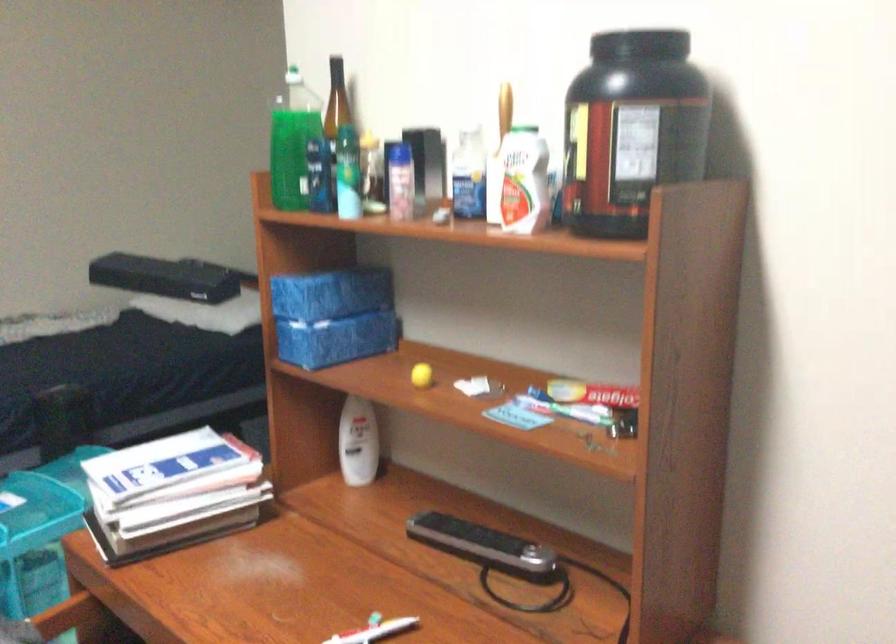
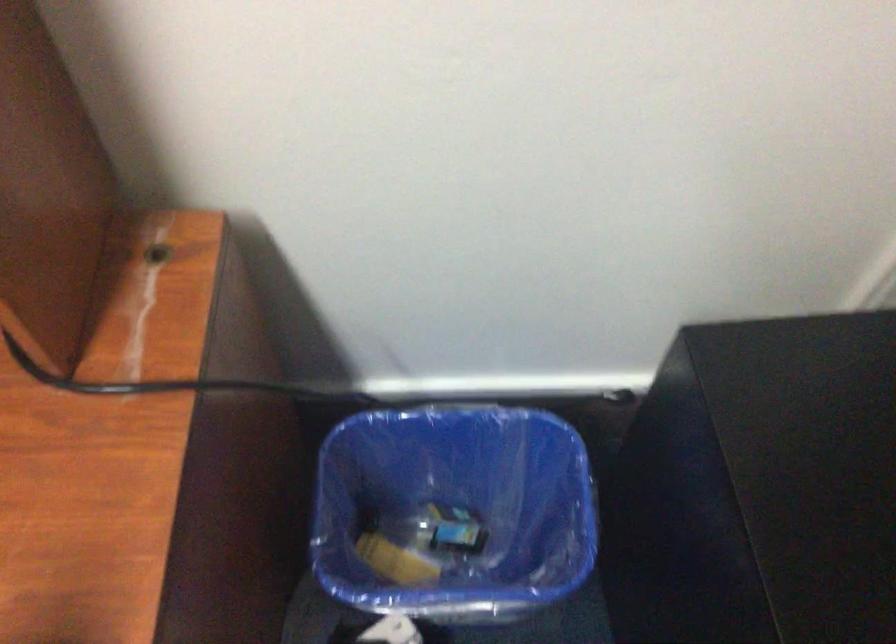
First-person continuous shooting, in which direction is the camera rotating?

The camera's rotation is toward right-down.